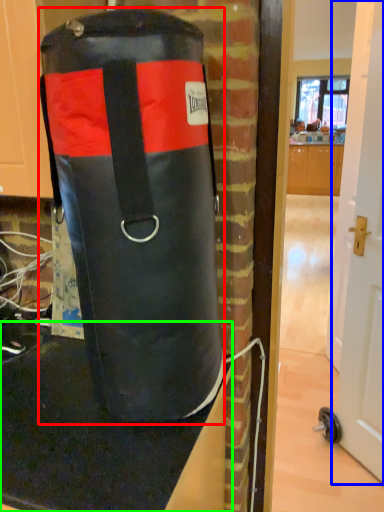
Question: Estimate the real-world distances between objects in this image. Which object is closer to punching bag (highlighted by a red box), door (highlighted by a blue box) or table top (highlighted by a green box)?

Choices:
 (A) door
 (B) table top

Answer: (B)